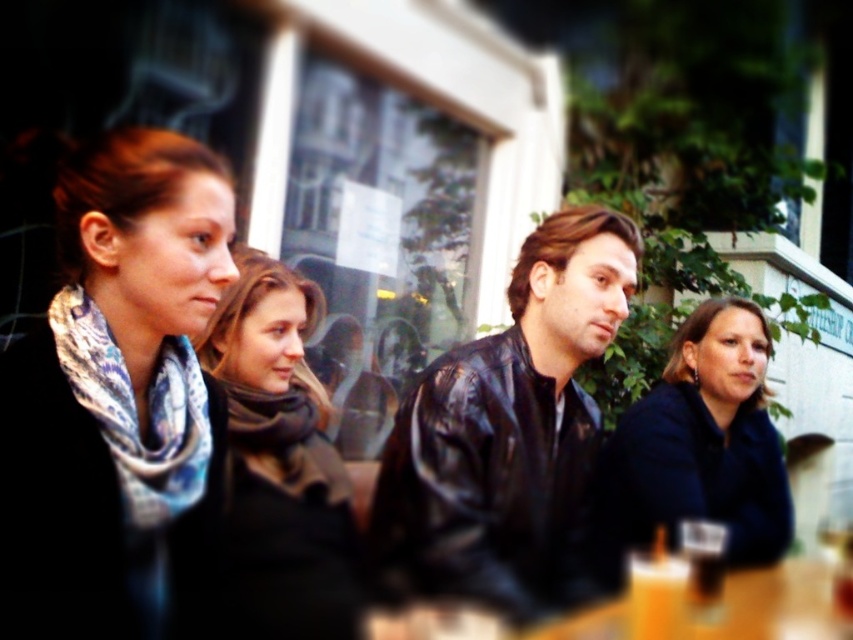
Does printed silk scarf at left have a greater width compared to orange liquid at lower right?

Yes, printed silk scarf at left is wider than orange liquid at lower right.

Is point (134, 499) less distant than point (654, 576)?

Yes, point (134, 499) is closer to viewer.

Which is in front, point (194, 440) or point (674, 557)?

Point (194, 440) is in front.

Identify the location of printed silk scarf at left. The height and width of the screenshot is (640, 853). (137, 410).

Who is positioned more to the left, printed scarf at left or dark blue jacket at center?

printed scarf at left

Consider the image. Does printed scarf at left have a greater height compared to dark blue jacket at center?

Indeed, printed scarf at left has a greater height compared to dark blue jacket at center.

Locate an element on the screen. This screenshot has width=853, height=640. printed scarf at left is located at coordinates (115, 396).

Locate an element on the screen. The height and width of the screenshot is (640, 853). printed scarf at left is located at coordinates (115, 396).

Who is taller, dark blue jacket at center or wooden table at lower right?

dark blue jacket at center

Image resolution: width=853 pixels, height=640 pixels. In order to click on dark blue jacket at center in this screenshot , I will do `click(704, 440)`.